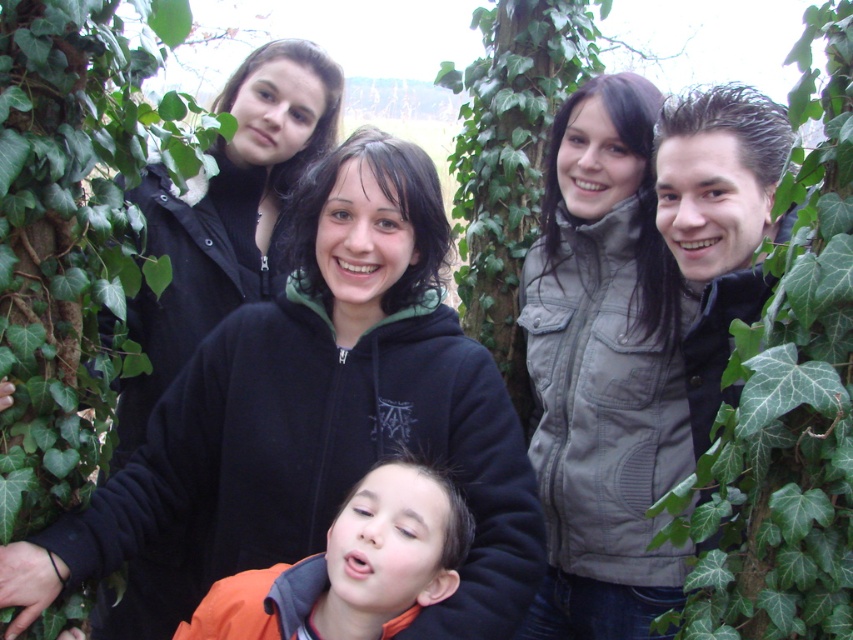
Does point (167, 96) come farther from viewer compared to point (412, 557)?

Yes, it is behind point (412, 557).

The width and height of the screenshot is (853, 640). What do you see at coordinates (76, 230) in the screenshot? I see `green leafy ivy at center` at bounding box center [76, 230].

Between point (39, 499) and point (277, 627), which one is positioned in front?

Point (277, 627) is more forward.

The width and height of the screenshot is (853, 640). Identify the location of green leafy ivy at center. (76, 230).

Is green leafy ivy at center to the right of green leafy ivy at upper right from the viewer's perspective?

In fact, green leafy ivy at center is to the left of green leafy ivy at upper right.

Who is lower down, green leafy ivy at center or green leafy ivy at upper right?

green leafy ivy at upper right is lower down.

The width and height of the screenshot is (853, 640). Describe the element at coordinates (76, 230) in the screenshot. I see `green leafy ivy at center` at that location.

The width and height of the screenshot is (853, 640). What are the coordinates of `green leafy ivy at center` in the screenshot? It's located at (76, 230).

Based on the photo, is green leafy ivy at upper right above orange fleece jacket at lower center?

Yes.

Between green leafy ivy at upper right and orange fleece jacket at lower center, which one appears on the right side from the viewer's perspective?

green leafy ivy at upper right

Who is more forward, (790,180) or (318,634)?

Point (790,180) is in front.

At what (x,y) coordinates should I click in order to perform the action: click on green leafy ivy at upper right. Please return your answer as a coordinate pair (x, y). Image resolution: width=853 pixels, height=640 pixels. Looking at the image, I should click on (785, 397).